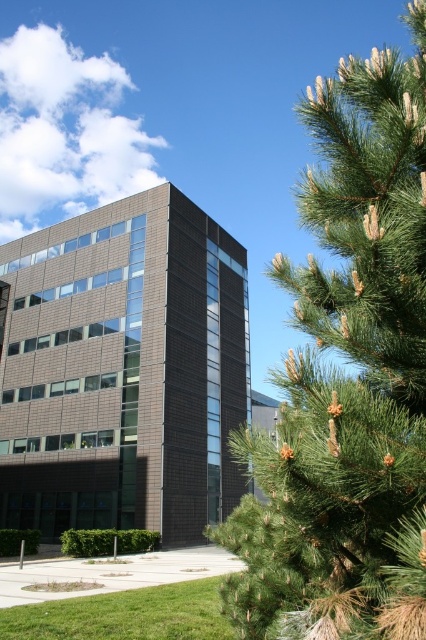
Does green needle-like at right appear on the left side of brown brick building at center?

Incorrect, green needle-like at right is not on the left side of brown brick building at center.

In the scene shown: Does green needle-like at right lie behind brown brick building at center?

That is False.

Where is `green needle-like at right`? Image resolution: width=426 pixels, height=640 pixels. green needle-like at right is located at coordinates (347, 380).

At what (x,y) coordinates should I click in order to perform the action: click on green needle-like at right. Please return your answer as a coordinate pair (x, y). This screenshot has height=640, width=426. Looking at the image, I should click on (347, 380).